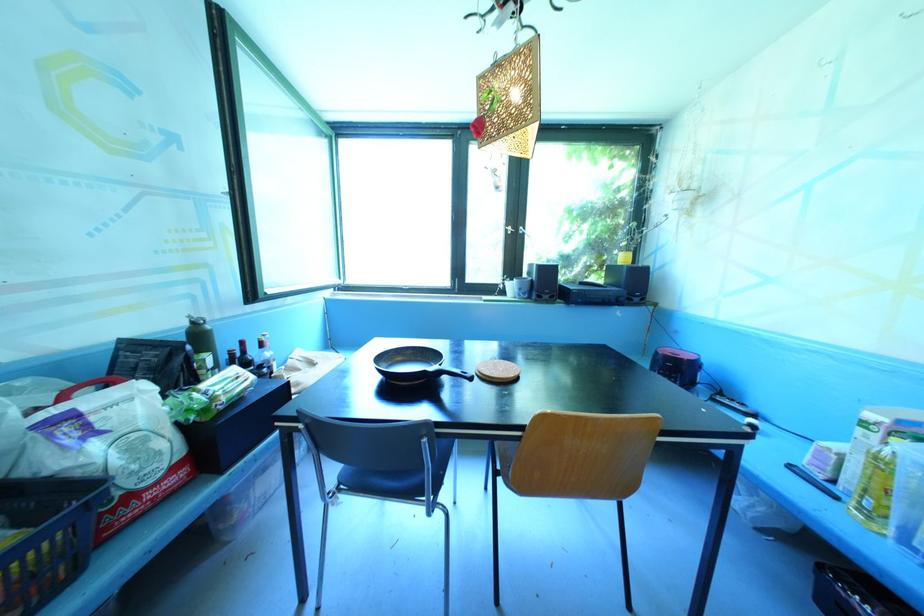
What do you see at coordinates (81, 379) in the screenshot? Image resolution: width=924 pixels, height=616 pixels. I see `the red bag handle` at bounding box center [81, 379].